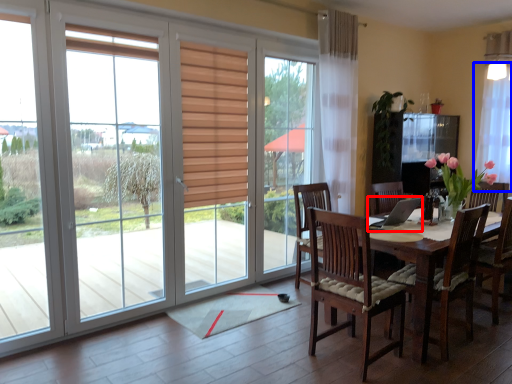
Question: Which object is further to the camera taking this photo, laptop (highlighted by a red box) or curtain (highlighted by a blue box)?

Choices:
 (A) laptop
 (B) curtain

Answer: (B)